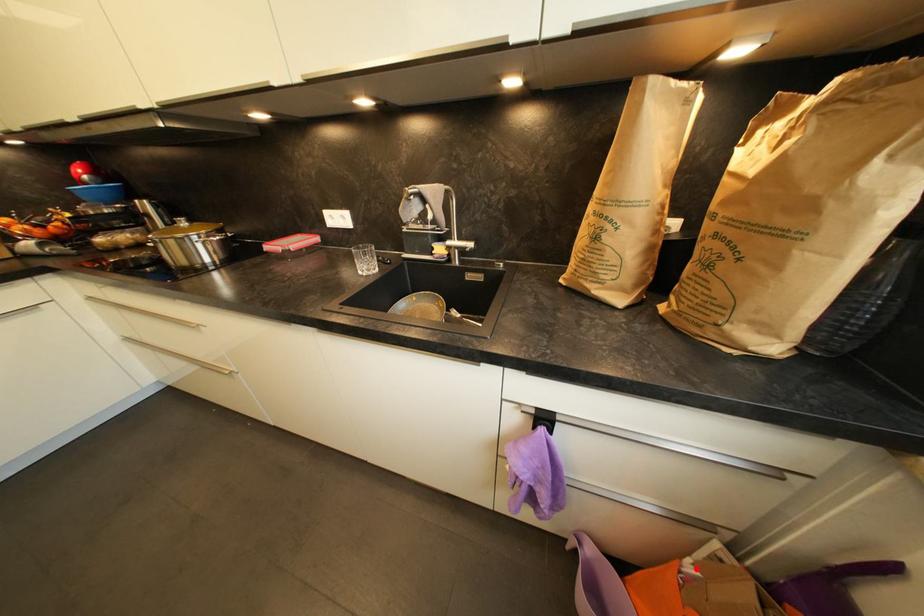
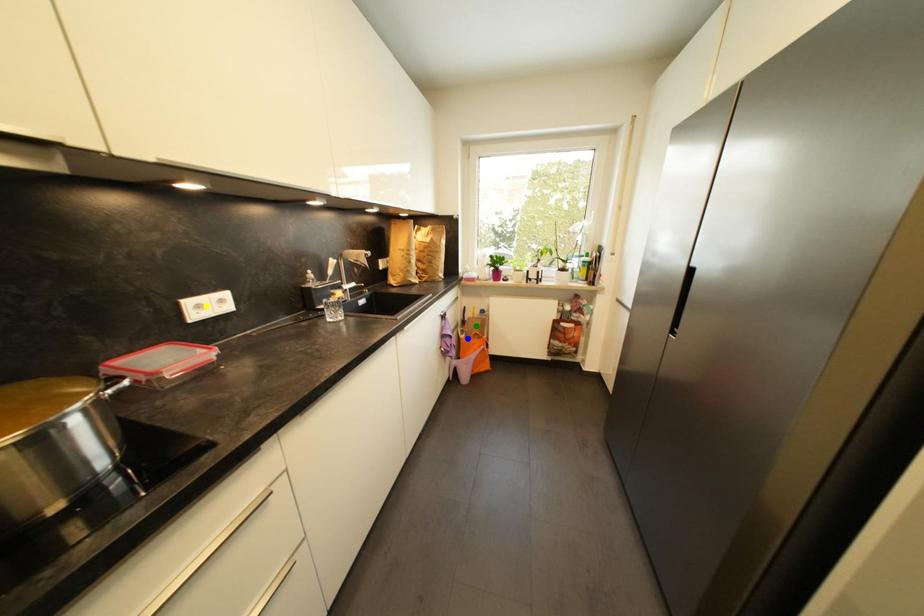
Question: I am providing you with two images of the same scene from different viewpoints. A red point is marked on the first image. You are given multiple points on the second image. Which point in image 2 is actually the same real-world point as the red point in image 1?

Choices:
 (A) blue point
 (B) yellow point
 (C) green point

Answer: (A)